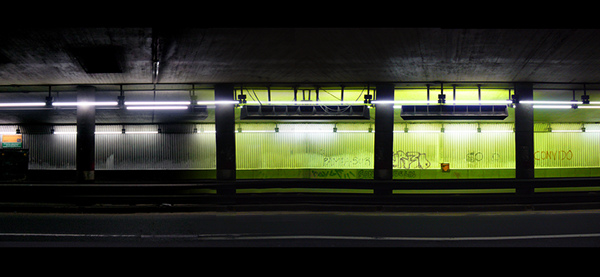
You are a GUI agent. You are given a task and a screenshot of the screen. Output one action in this format:
    pyautogui.click(x=<x>, y=<y>)
    Task: Click on the vents
    Image resolution: width=600 pixels, height=277 pixels.
    Given the screenshot: What is the action you would take?
    pyautogui.click(x=489, y=115), pyautogui.click(x=315, y=110)